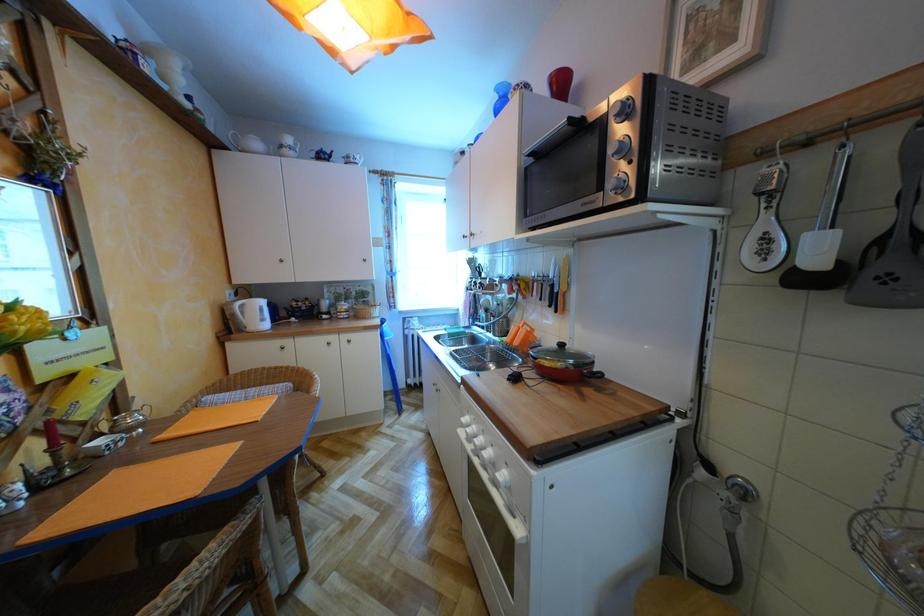
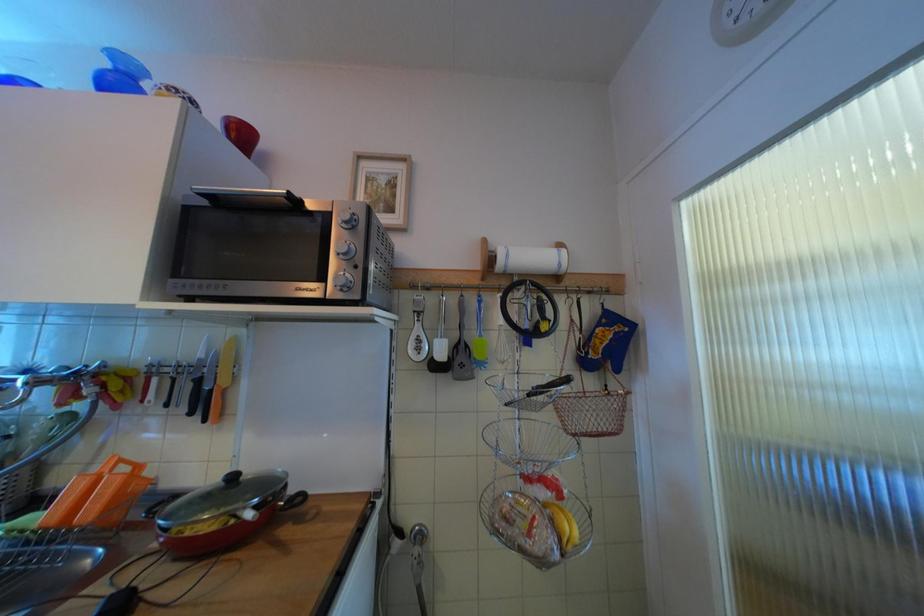
Question: Based on the continuous images, in which direction is the camera rotating? Reply with the corresponding letter.

Choices:
 (A) Left
 (B) Right
 (C) Up
 (D) Down

Answer: (B)